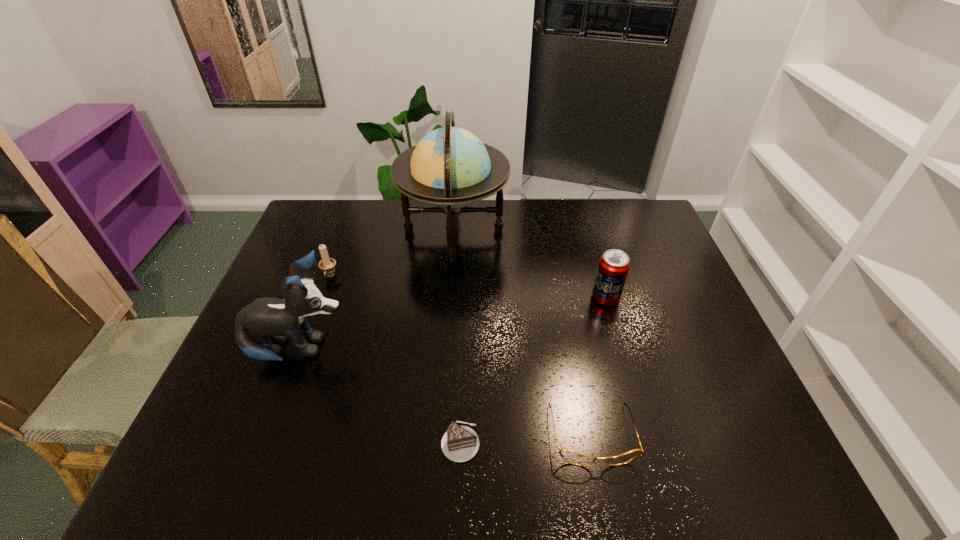
This screenshot has height=540, width=960. In the image, there is a desktop. What are the coordinates of `vacant space at the far edge` in the screenshot? It's located at (391, 204).

Locate an element on the screen. The width and height of the screenshot is (960, 540). vacant space at the left edge of the desktop is located at coordinates (305, 244).

Where is `free region at the right edge`? free region at the right edge is located at coordinates (667, 330).

Where is `vacant area at the far right corner`? This screenshot has height=540, width=960. vacant area at the far right corner is located at coordinates (632, 237).

At what (x,y) coordinates should I click in order to perform the action: click on vacant area that lies between the fourth farthest object and the spectacles. Please return your answer as a coordinate pair (x, y). Looking at the image, I should click on (445, 393).

The width and height of the screenshot is (960, 540). Identify the location of unoccupied area between the puppy and the farthest object. (377, 291).

You are a GUI agent. You are given a task and a screenshot of the screen. Output one action in this format:
    pyautogui.click(x=<x>, y=<y>)
    Task: Click on the empty space that is in between the chocolate cake and the fourth farthest object
    The width and height of the screenshot is (960, 540).
    Given the screenshot: What is the action you would take?
    pyautogui.click(x=380, y=397)

Find the location of a particular element. This screenshot has height=540, width=960. vacant point located between the soda can and the candle_holder is located at coordinates (468, 287).

This screenshot has height=540, width=960. What are the coordinates of `vacant region between the fourth farthest object and the tallest object` in the screenshot? It's located at (377, 291).

In order to click on vacant area that lies between the farthest object and the third nearest object in this screenshot , I will do `click(377, 291)`.